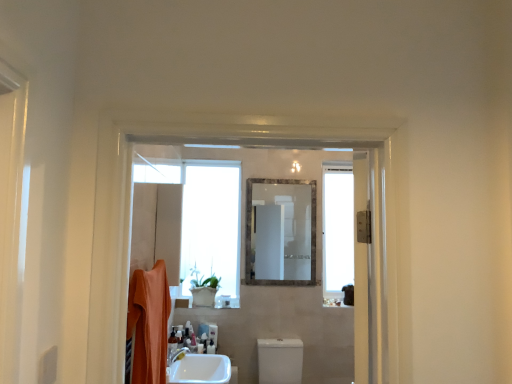
Question: Based on their positions, is transparent glass window at right located to the left or right of silver metallic mirror at center?

Choices:
 (A) right
 (B) left

Answer: (A)

Question: Which is correct: transparent glass window at right is inside silver metallic mirror at center, or outside of it?

Choices:
 (A) outside
 (B) inside

Answer: (A)

Question: Estimate the real-world distances between objects in this image. Which object is closer to the white glossy tap at lower center?

Choices:
 (A) silver metallic mirror at center
 (B) transparent glass window at right
 (C) translucent plastic soap dispenser at lower center, the second toiletry in the front-to-back sequence
 (D) translucent plastic bottle at lower center, which is counted as the 2th toiletry, starting from the right
 (E) orange cotton bath towel at left

Answer: (D)

Question: Considering the real-world distances, which object is farthest from the transparent glass window at right?

Choices:
 (A) silver metallic mirror at center
 (B) orange cotton bath towel at left
 (C) translucent plastic bottle at lower center, which appears as the first toiletry when viewed from the front
 (D) white glossy tap at lower center
 (E) white glossy toilet at center

Answer: (B)